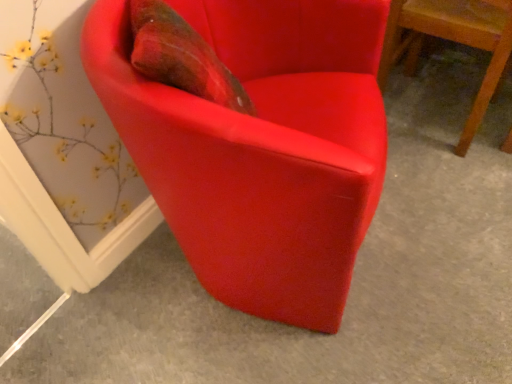
Question: Should I look upward or downward to see satin red armchair at center, which ranks as the 1th chair in left-to-right order?

Choices:
 (A) down
 (B) up

Answer: (B)

Question: From the image's perspective, is satin red armchair at lower right, acting as the 2th chair starting from the left, over satin red armchair at center, which ranks as the 1th chair in left-to-right order?

Choices:
 (A) yes
 (B) no

Answer: (A)

Question: Is satin red armchair at lower right, acting as the 2th chair starting from the left, completely or partially outside of satin red armchair at center, positioned as the second chair in right-to-left order?

Choices:
 (A) no
 (B) yes

Answer: (B)

Question: Is satin red armchair at lower right, acting as the 2th chair starting from the left, looking in the opposite direction of satin red armchair at center, which ranks as the 1th chair in left-to-right order?

Choices:
 (A) yes
 (B) no

Answer: (A)

Question: From the image's perspective, would you say satin red armchair at lower right, acting as the first chair starting from the right, is shown under satin red armchair at center, which ranks as the 1th chair in left-to-right order?

Choices:
 (A) no
 (B) yes

Answer: (A)

Question: Considering the relative sizes of satin red armchair at lower right, acting as the first chair starting from the right, and satin red armchair at center, positioned as the second chair in right-to-left order, in the image provided, is satin red armchair at lower right, acting as the first chair starting from the right, smaller than satin red armchair at center, positioned as the second chair in right-to-left order,?

Choices:
 (A) yes
 (B) no

Answer: (A)

Question: From a real-world perspective, is satin red armchair at lower right, acting as the first chair starting from the right, on satin red armchair at center, positioned as the second chair in right-to-left order?

Choices:
 (A) yes
 (B) no

Answer: (B)

Question: Are satin red armchair at center, positioned as the second chair in right-to-left order, and satin red armchair at lower right, acting as the first chair starting from the right, far apart?

Choices:
 (A) no
 (B) yes

Answer: (A)

Question: From a real-world perspective, is satin red armchair at center, positioned as the second chair in right-to-left order, on top of satin red armchair at lower right, acting as the 2th chair starting from the left?

Choices:
 (A) yes
 (B) no

Answer: (A)

Question: Is satin red armchair at center, which ranks as the 1th chair in left-to-right order, taller than satin red armchair at lower right, acting as the first chair starting from the right?

Choices:
 (A) yes
 (B) no

Answer: (A)

Question: Is satin red armchair at center, positioned as the second chair in right-to-left order, aimed at satin red armchair at lower right, acting as the 2th chair starting from the left?

Choices:
 (A) yes
 (B) no

Answer: (B)

Question: Is satin red armchair at lower right, acting as the first chair starting from the right, completely or partially inside satin red armchair at center, which ranks as the 1th chair in left-to-right order?

Choices:
 (A) no
 (B) yes

Answer: (A)

Question: Is satin red armchair at center, positioned as the second chair in right-to-left order, smaller than satin red armchair at lower right, acting as the 2th chair starting from the left?

Choices:
 (A) no
 (B) yes

Answer: (A)

Question: Looking at the image, does satin red armchair at center, positioned as the second chair in right-to-left order, seem bigger or smaller compared to satin red armchair at lower right, acting as the 2th chair starting from the left?

Choices:
 (A) small
 (B) big

Answer: (B)